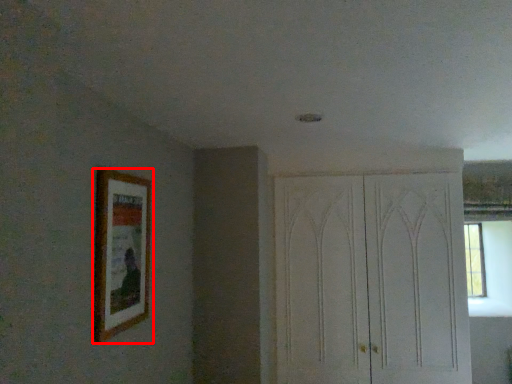
Question: In this image, where is picture frame (annotated by the red box) located relative to dresser?

Choices:
 (A) left
 (B) right

Answer: (A)